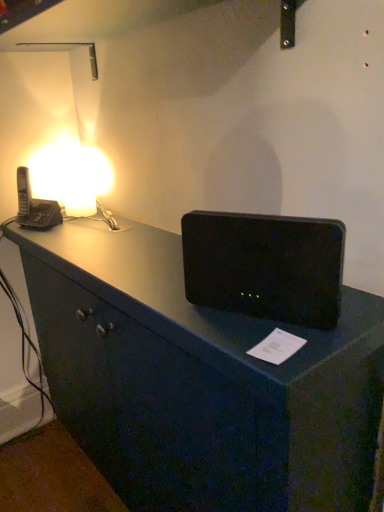
Question: Considering the relative sizes of black plastic phone at left and matte white lamp at upper left in the image provided, is black plastic phone at left shorter than matte white lamp at upper left?

Choices:
 (A) no
 (B) yes

Answer: (B)

Question: Is black plastic phone at left at the left side of matte white lamp at upper left?

Choices:
 (A) no
 (B) yes

Answer: (B)

Question: Is black plastic phone at left completely or partially outside of matte white lamp at upper left?

Choices:
 (A) yes
 (B) no

Answer: (A)

Question: Is black plastic phone at left taller than matte white lamp at upper left?

Choices:
 (A) yes
 (B) no

Answer: (B)

Question: Is the position of black plastic phone at left more distant than that of matte white lamp at upper left?

Choices:
 (A) no
 (B) yes

Answer: (A)

Question: Is matte white lamp at upper left inside or outside of black plastic speaker at center?

Choices:
 (A) outside
 (B) inside

Answer: (A)

Question: Considering the positions of matte white lamp at upper left and black plastic speaker at center in the image, is matte white lamp at upper left taller or shorter than black plastic speaker at center?

Choices:
 (A) short
 (B) tall

Answer: (B)

Question: Based on their sizes in the image, would you say matte white lamp at upper left is bigger or smaller than black plastic speaker at center?

Choices:
 (A) big
 (B) small

Answer: (B)

Question: Considering the positions of point (76, 159) and point (304, 218), is point (76, 159) closer or farther from the camera than point (304, 218)?

Choices:
 (A) closer
 (B) farther

Answer: (B)

Question: Based on their positions, is black plastic speaker at center located to the left or right of black plastic phone at left?

Choices:
 (A) right
 (B) left

Answer: (A)

Question: From the image's perspective, is black plastic speaker at center positioned above or below black plastic phone at left?

Choices:
 (A) below
 (B) above

Answer: (A)

Question: Looking at the image, does black plastic speaker at center seem bigger or smaller compared to black plastic phone at left?

Choices:
 (A) big
 (B) small

Answer: (B)

Question: From their relative heights in the image, would you say black plastic speaker at center is taller or shorter than black plastic phone at left?

Choices:
 (A) tall
 (B) short

Answer: (B)

Question: From the image's perspective, is black plastic phone at left above or below matte white lamp at upper left?

Choices:
 (A) below
 (B) above

Answer: (A)

Question: Considering the positions of black plastic phone at left and matte white lamp at upper left in the image, is black plastic phone at left taller or shorter than matte white lamp at upper left?

Choices:
 (A) tall
 (B) short

Answer: (B)